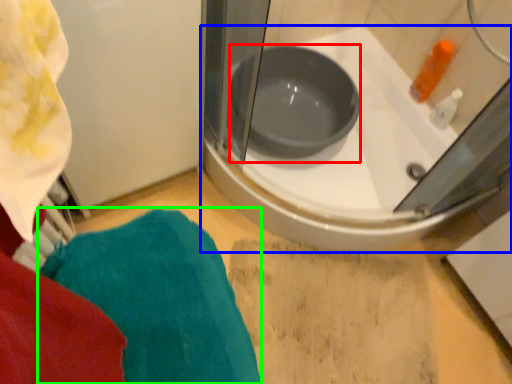
Question: Estimate the real-world distances between objects in this image. Which object is farther from basin (highlighted by a red box), bathtub (highlighted by a blue box) or bath towel (highlighted by a green box)?

Choices:
 (A) bathtub
 (B) bath towel

Answer: (B)